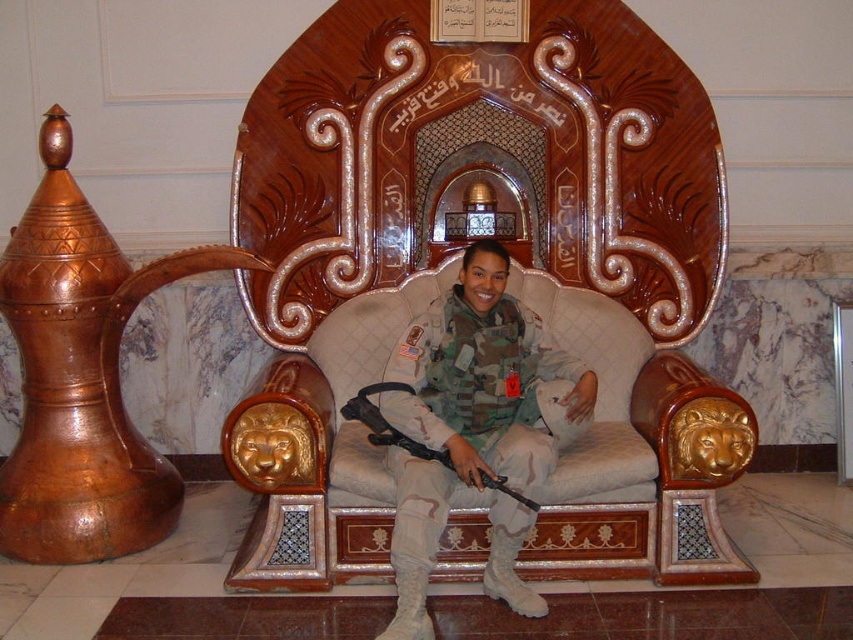
Question: Can you confirm if wooden throne at center is thinner than camouflage uniform at center?

Choices:
 (A) yes
 (B) no

Answer: (B)

Question: Does wooden throne at center have a smaller size compared to camouflage uniform at center?

Choices:
 (A) no
 (B) yes

Answer: (A)

Question: Is wooden throne at center bigger than camouflage uniform at center?

Choices:
 (A) no
 (B) yes

Answer: (B)